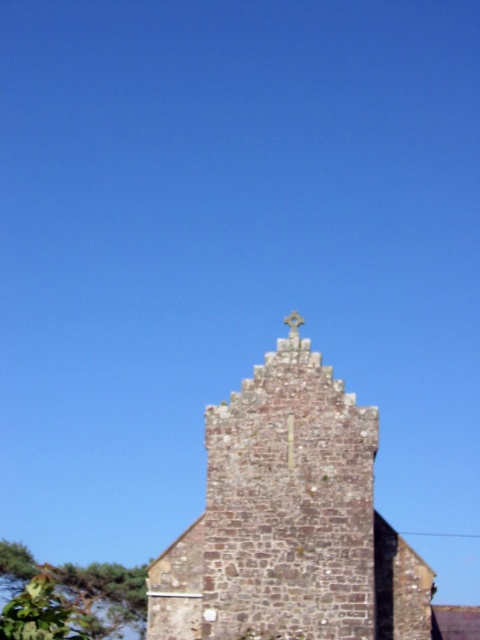
Is brown stone tower at center taller than white stone cross at center?

Yes.

Who is more forward, (180, 624) or (301, 323)?

Point (301, 323) is more forward.

Identify the location of brown stone tower at center. (289, 522).

Image resolution: width=480 pixels, height=640 pixels. I want to click on brown stone tower at center, so click(289, 522).